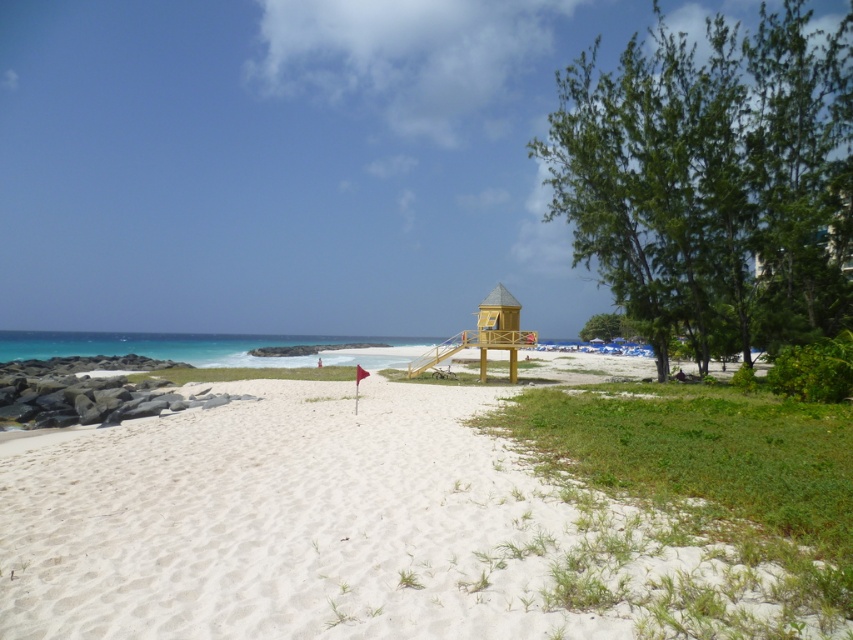
What do you see at coordinates (350, 531) in the screenshot? I see `white sandy beach at center` at bounding box center [350, 531].

Does white sandy beach at center have a lesser width compared to green leafy tree at center-right?

In fact, white sandy beach at center might be wider than green leafy tree at center-right.

Which is behind, point (306, 529) or point (608, 316)?

Positioned behind is point (608, 316).

In order to click on white sandy beach at center in this screenshot , I will do `click(350, 531)`.

Is point (677, 116) closer to viewer compared to point (614, 330)?

Yes, point (677, 116) is in front of point (614, 330).

Does green leafy tree at right appear on the right side of green leafy tree at center-right?

Yes, green leafy tree at right is to the right of green leafy tree at center-right.

Is point (599, 180) closer to camera compared to point (606, 328)?

Yes, point (599, 180) is in front of point (606, 328).

I want to click on green leafy tree at right, so click(x=712, y=180).

Between point (611, 509) and point (798, 282), which one is positioned behind?

Point (798, 282)

Between point (115, 426) and point (631, 42), which one is positioned behind?

The point (631, 42) is behind.

This screenshot has height=640, width=853. What are the coordinates of `white sandy beach at center` in the screenshot? It's located at (350, 531).